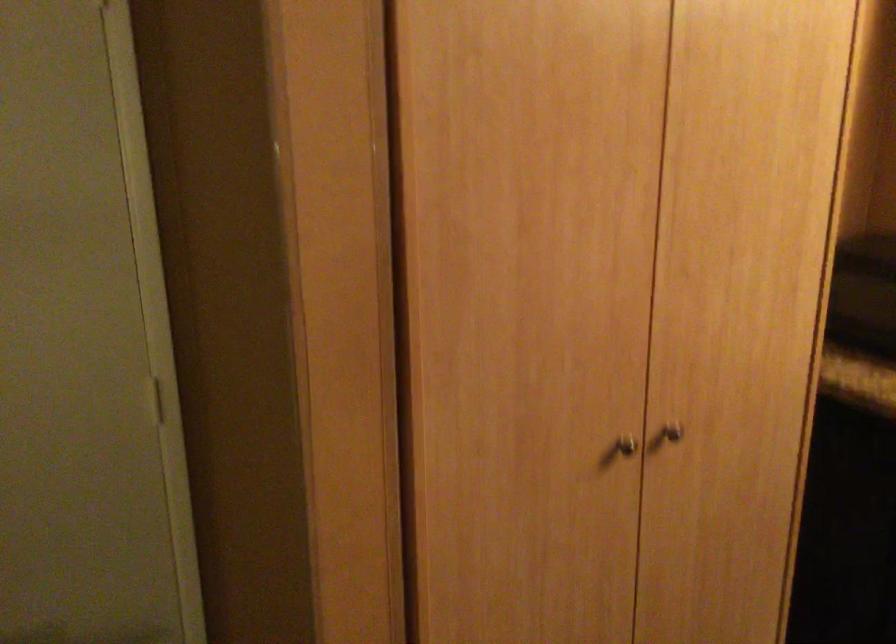
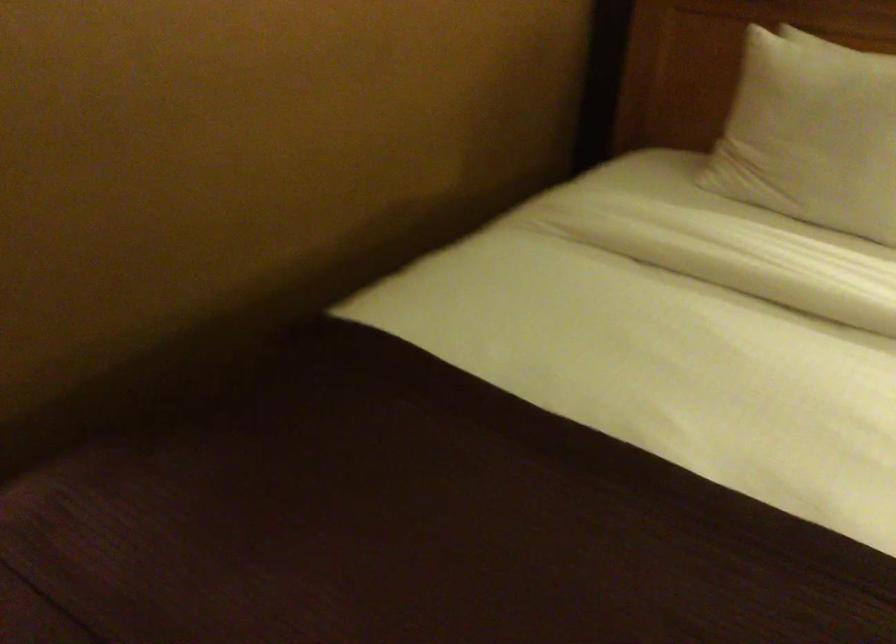
First-person continuous shooting, in which direction is the camera rotating?

The camera rotated toward right-down.